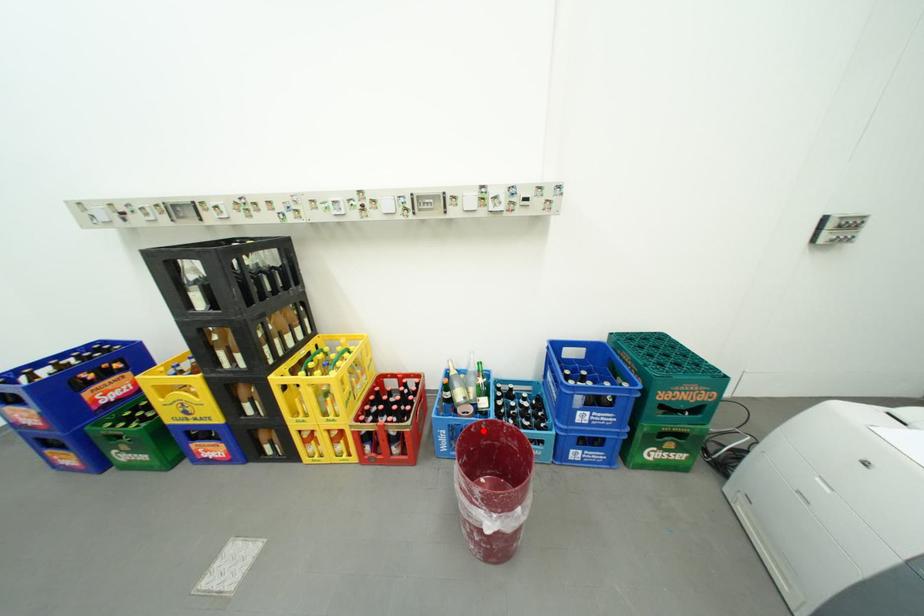
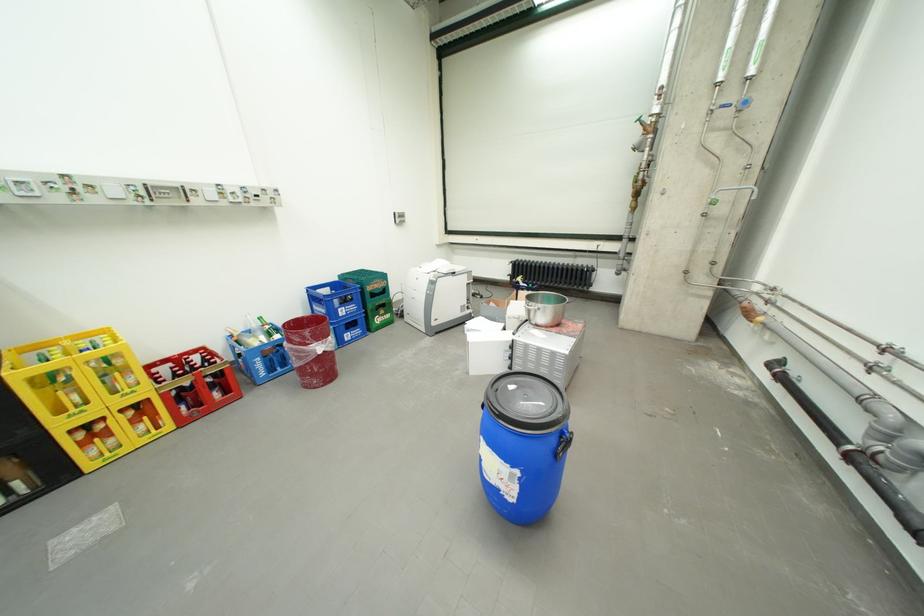
Question: I am providing you with two images of the same scene from different viewpoints. Given a red point in image1, look at the same physical point in image2. Is it:

Choices:
 (A) Closer to the viewpoint
 (B) Farther from the viewpoint

Answer: (B)